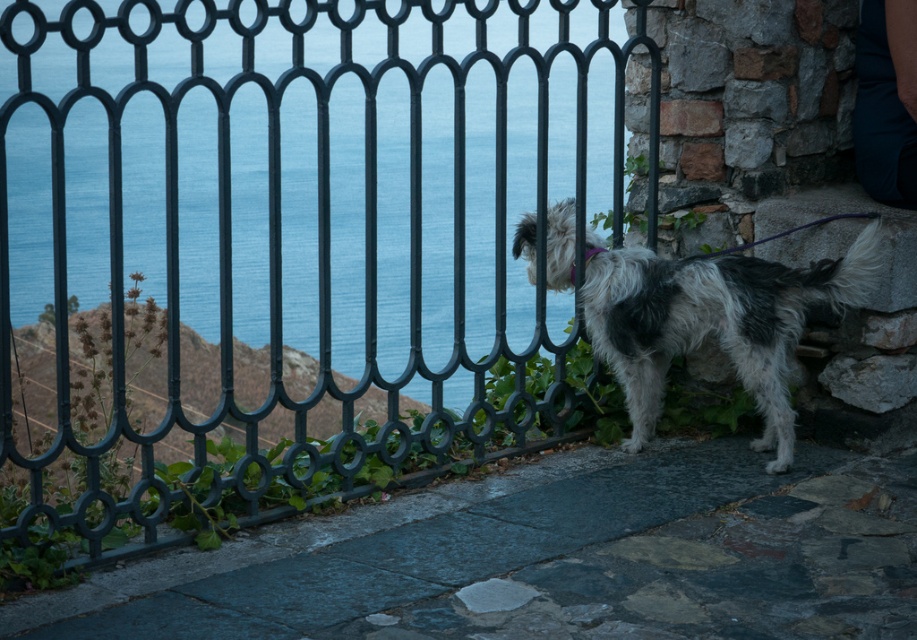
Question: Can you confirm if black wrought iron fence at upper center is wider than white-furred dog at center?

Choices:
 (A) yes
 (B) no

Answer: (A)

Question: Which of the following is the farthest from the observer?

Choices:
 (A) (837, 266)
 (B) (297, 406)

Answer: (A)

Question: Which point is farther from the camera taking this photo?

Choices:
 (A) pos(318,83)
 (B) pos(606,260)

Answer: (B)

Question: Is black wrought iron fence at upper center wider than white-furred dog at center?

Choices:
 (A) yes
 (B) no

Answer: (A)

Question: Does black wrought iron fence at upper center come in front of white-furred dog at center?

Choices:
 (A) yes
 (B) no

Answer: (A)